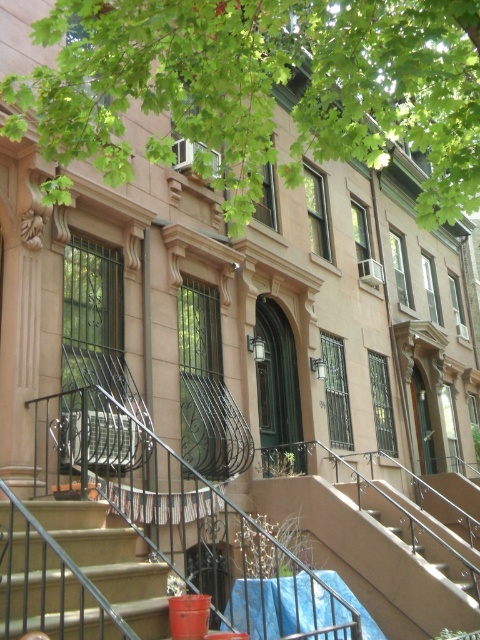
Question: Which object appears farthest from the camera in this image?

Choices:
 (A) green leafy tree at upper center
 (B) smooth concrete stairs at center

Answer: (A)

Question: Does green leafy tree at upper center appear under smooth concrete stairs at center?

Choices:
 (A) yes
 (B) no

Answer: (B)

Question: Which of the following is the farthest from the observer?

Choices:
 (A) smooth concrete stairs at center
 (B) green leafy tree at upper center

Answer: (B)

Question: Which object is farther from the camera taking this photo?

Choices:
 (A) smooth concrete stairs at center
 (B) green leafy tree at upper center

Answer: (B)

Question: Is green leafy tree at upper center positioned behind smooth concrete stairs at center?

Choices:
 (A) no
 (B) yes

Answer: (B)

Question: Is green leafy tree at upper center to the left of smooth concrete stairs at center from the viewer's perspective?

Choices:
 (A) yes
 (B) no

Answer: (B)